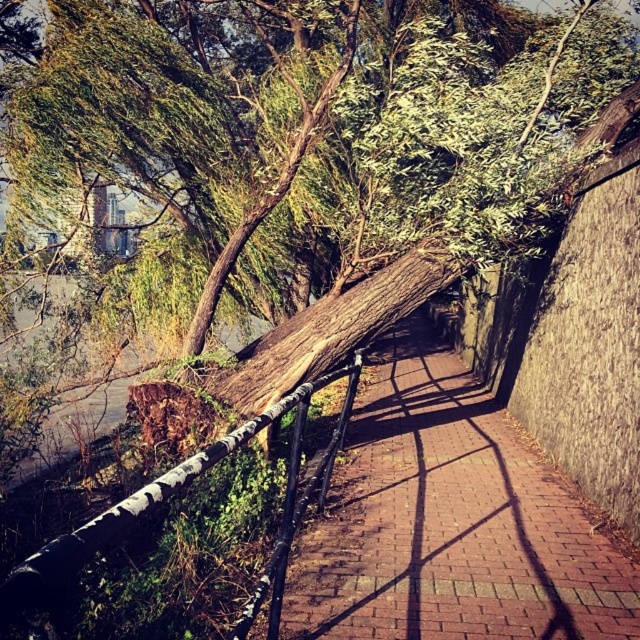
You are a construction worker needing to repair the pathway. You have a tool that can only handle objects smaller than the brick pavement at center. Can you use this tool on the white painted metal rail at center?

The brick pavement at center is larger in size than the white painted metal rail at center. Since the tool can handle objects smaller than the brick pavement at center, the white painted metal rail at center can be repaired with the tool as it is smaller in size.